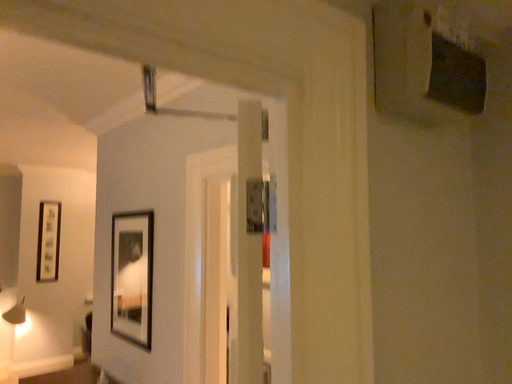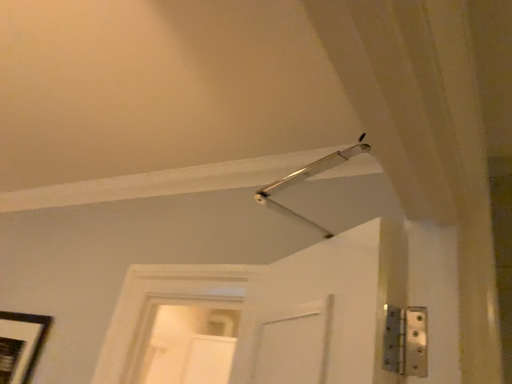
Question: Which way did the camera rotate in the video?

Choices:
 (A) rotated upward
 (B) rotated downward

Answer: (A)